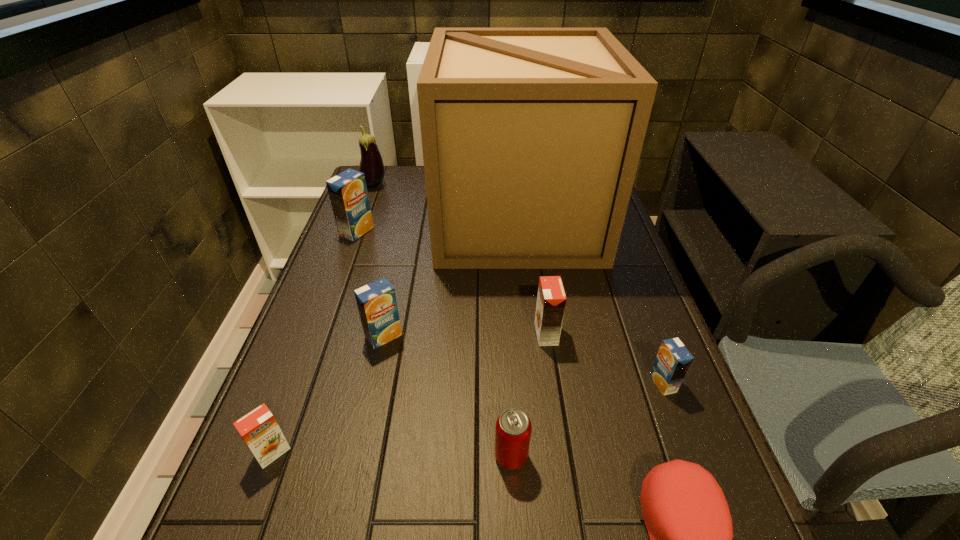
You are a GUI agent. You are given a task and a screenshot of the screen. Output one action in this format:
    pyautogui.click(x=<x>, y=<y>)
    Task: Click on the tallest object
    The width and height of the screenshot is (960, 540).
    Given the screenshot: What is the action you would take?
    pyautogui.click(x=531, y=137)

This screenshot has width=960, height=540. I want to click on the eighth shortest object, so click(x=371, y=164).

Locate an element on the screen. This screenshot has width=960, height=540. the seventh shortest object is located at coordinates (348, 194).

Image resolution: width=960 pixels, height=540 pixels. Find the location of `the farthest orange juice`. the farthest orange juice is located at coordinates (348, 194).

In order to click on the right orange orange juice in this screenshot , I will do `click(551, 300)`.

This screenshot has width=960, height=540. In order to click on the second orange juice from right to left in this screenshot , I will do `click(551, 300)`.

The image size is (960, 540). Find the location of `the second blue orange_juice from right to left`. the second blue orange_juice from right to left is located at coordinates (377, 304).

Locate an element on the screen. The height and width of the screenshot is (540, 960). the sixth object from right to left is located at coordinates (377, 304).

The image size is (960, 540). Find the location of `can`. can is located at coordinates (513, 429).

Find the location of a particular element. The width and height of the screenshot is (960, 540). the rightmost blue orange_juice is located at coordinates [x=673, y=360].